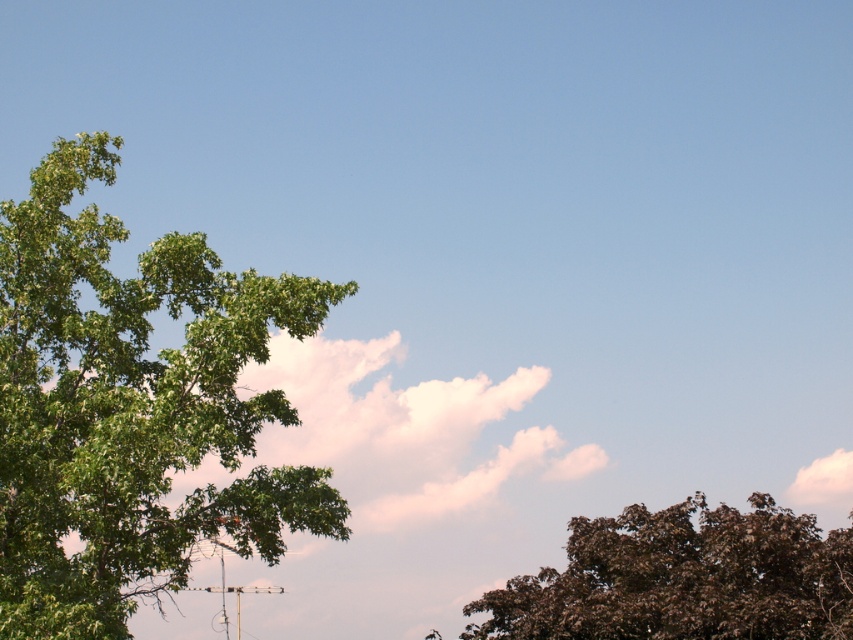
Question: Which point is farther to the camera?

Choices:
 (A) (808, 580)
 (B) (1, 544)

Answer: (A)

Question: Is green leafy tree at left above brown textured tree at lower right?

Choices:
 (A) no
 (B) yes

Answer: (B)

Question: Does green leafy tree at left have a lesser width compared to brown textured tree at lower right?

Choices:
 (A) no
 (B) yes

Answer: (B)

Question: Does green leafy tree at left have a larger size compared to brown textured tree at lower right?

Choices:
 (A) yes
 (B) no

Answer: (B)